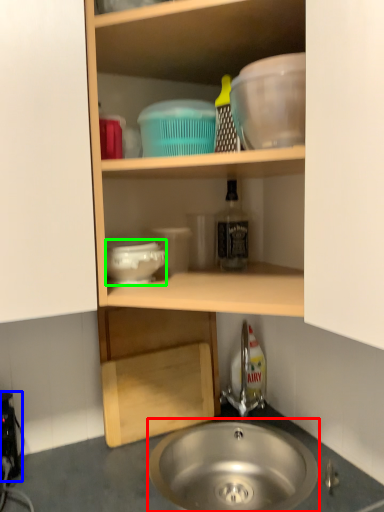
Question: Which object is the farthest from sink (highlighted by a red box)? Choose among these: appliance (highlighted by a blue box) or basin (highlighted by a green box).

Choices:
 (A) appliance
 (B) basin

Answer: (B)